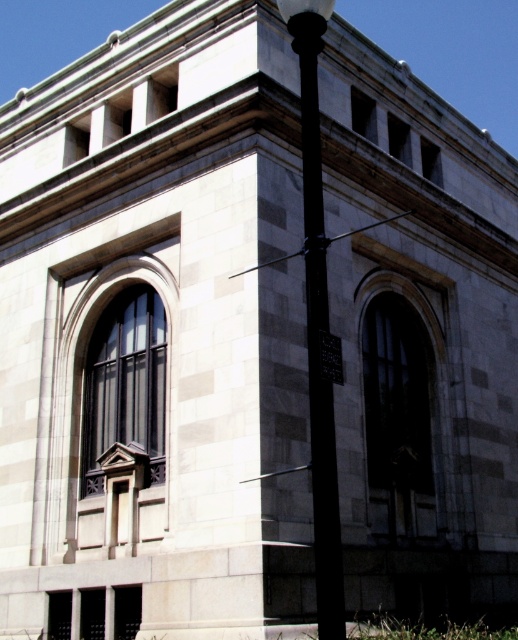
You are a maintenance worker checking the height of the black metal pole at center and the black plastic sign at center. Which object is taller?

The black metal pole at center is taller than the black plastic sign at center.

You are standing at the center of the classical building section shown in the image. There is a black metal pole marked at point (318, 320). If you face the direction of the lamppost, which direction should you turn to walk towards the nearest arched window with dark frames?

The point (318, 320) marks the black metal pole at center. Since the lamppost is positioned off to the right, facing it would mean turning to your right from the center position. The nearest arched window with dark frames would likely be to the left or right side depending on the building symmetry, but based on the description, the lamppost is at center, so turning towards the lamppost direction would align you towards the right side of the building where the windows are. However, without explicit spatial